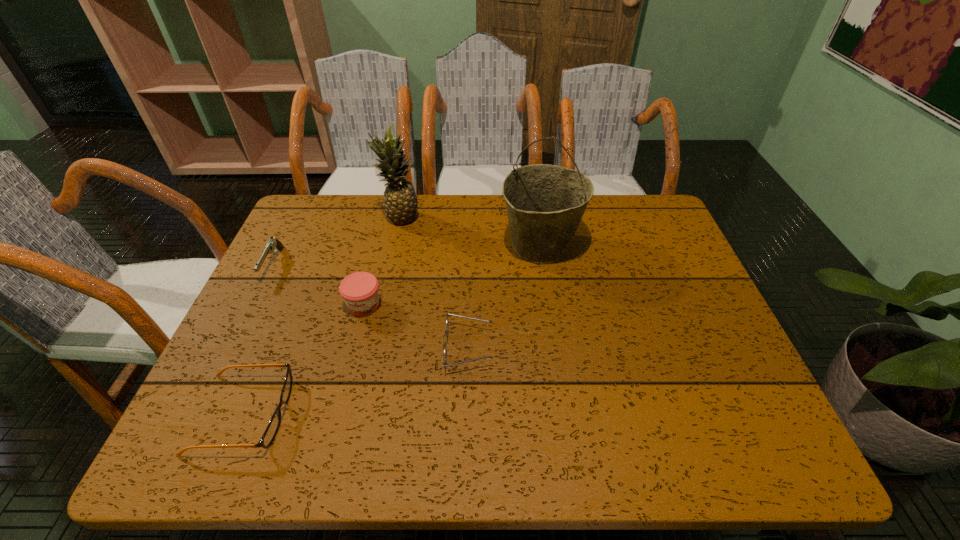
I want to click on the rightmost object, so click(545, 203).

At what (x,y) coordinates should I click in order to perform the action: click on pineapple. Please return your answer as a coordinate pair (x, y). Looking at the image, I should click on (400, 201).

You are a GUI agent. You are given a task and a screenshot of the screen. Output one action in this format:
    pyautogui.click(x=<x>, y=<y>)
    Task: Click on the third tallest object
    
    Given the screenshot: What is the action you would take?
    pyautogui.click(x=359, y=290)

Identify the location of jam. This screenshot has width=960, height=540. 359,290.

Find the location of a particular element. This screenshot has width=960, height=540. pistol is located at coordinates (273, 244).

Locate an element on the screen. the right spectacles is located at coordinates (445, 351).

This screenshot has width=960, height=540. Identify the location of the left spectacles. (274, 424).

The width and height of the screenshot is (960, 540). Identify the location of vacant position located on the front of the wine bucket. (562, 380).

At what (x,y) coordinates should I click in order to perform the action: click on free region located on the front of the fifth shortest object. Please return your answer as a coordinate pair (x, y). This screenshot has height=540, width=960. Looking at the image, I should click on (383, 296).

Where is `vacant point located on the front label of the third nearest object`? The image size is (960, 540). vacant point located on the front label of the third nearest object is located at coordinates (353, 347).